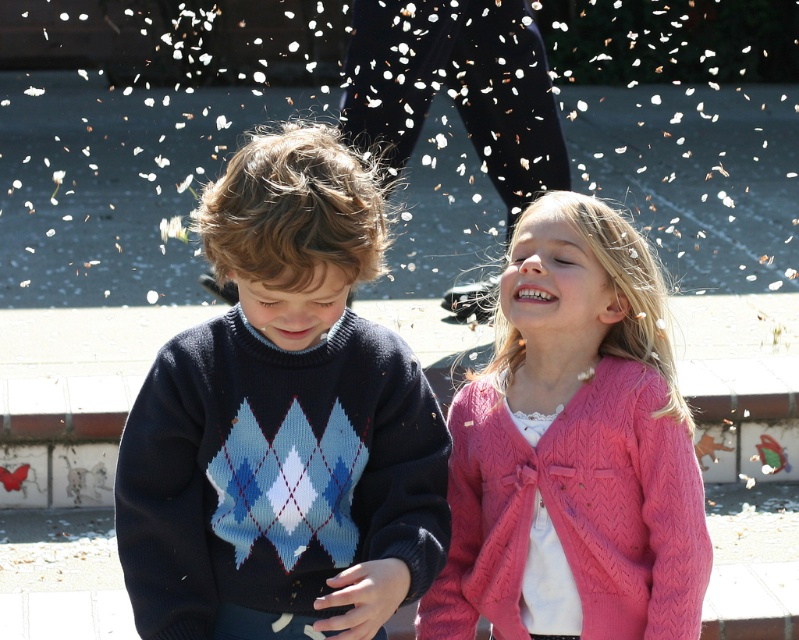
You are a tailor who needs to determine which garment requires more fabric to repair. Based on the image, which one is larger between the knitted sweater at center and the pink knitted cardigan at upper right?

The knitted sweater at center is bigger than the pink knitted cardigan at upper right, so it would require more fabric for repairs.

Based on the photo, you are a photographer trying to capture the knitted sweater at center in your shot. Based on the scene description, where should you position the camera to ensure the sweater is centered in the frame?

The knitted sweater at center is located at point coordinates (283, 422), so positioning the camera to focus on those coordinates will center the sweater in the frame.

You are a tailor observing two garments in the image. The knitted sweater at center and the pink knitted cardigan at upper right. Which garment has a greater height?

The knitted sweater at center is much taller than the pink knitted cardigan at upper right, so the knitted sweater at center has a greater height.